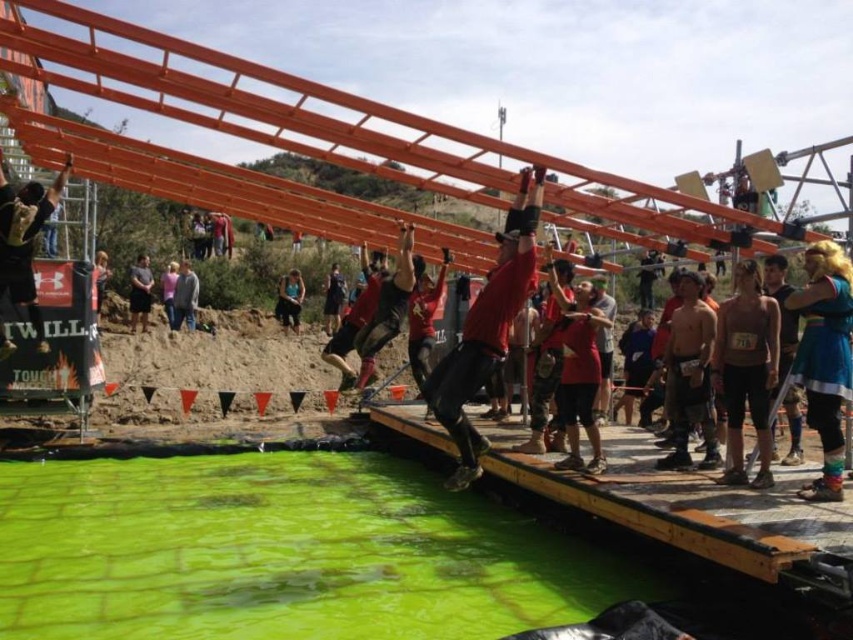
Which is in front, point (805, 356) or point (22, 195)?

Point (805, 356)

Based on the photo, who is positioned more to the right, teal fabric dress at center or matte black backpack at upper left?

teal fabric dress at center is more to the right.

At what (x,y) coordinates should I click in order to perform the action: click on teal fabric dress at center. Please return your answer as a coordinate pair (x, y). This screenshot has width=853, height=640. Looking at the image, I should click on (824, 356).

Does green algae water at lower center lie in front of black fabric at center?

That is True.

Based on the photo, does green algae water at lower center appear under black fabric at center?

Correct, green algae water at lower center is located below black fabric at center.

Who is more forward, (370,602) or (338,273)?

Point (370,602) is in front.

Where is `green algae water at lower center`? green algae water at lower center is located at coordinates (283, 552).

Can you confirm if red matte shirt at center is positioned to the right of black fabric at center?

Correct, you'll find red matte shirt at center to the right of black fabric at center.

Who is taller, red matte shirt at center or black fabric at center?

With more height is red matte shirt at center.

Measure the distance between point (467, 326) and camera.

Point (467, 326) and camera are 6.16 meters apart from each other.

Where is `red matte shirt at center`? red matte shirt at center is located at coordinates (486, 328).